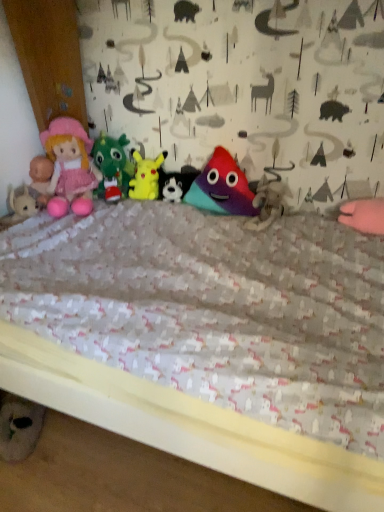
Question: Is matte plastic pyramid at center, arranged as the 3th toy when viewed from the right, positioned behind multicolored fabric triangle at center, which is counted as the fifth toy, starting from the left?

Choices:
 (A) yes
 (B) no

Answer: (A)

Question: From a real-world perspective, is matte plastic pyramid at center, marked as the 3th toy in a left-to-right arrangement, over multicolored fabric triangle at center, acting as the 1th toy starting from the right?

Choices:
 (A) no
 (B) yes

Answer: (B)

Question: From the image's perspective, would you say matte plastic pyramid at center, arranged as the 3th toy when viewed from the right, is shown under multicolored fabric triangle at center, acting as the 1th toy starting from the right?

Choices:
 (A) yes
 (B) no

Answer: (B)

Question: Is matte plastic pyramid at center, marked as the 3th toy in a left-to-right arrangement, positioned far away from multicolored fabric triangle at center, acting as the 1th toy starting from the right?

Choices:
 (A) yes
 (B) no

Answer: (B)

Question: Does matte plastic pyramid at center, arranged as the 3th toy when viewed from the right, appear on the left side of multicolored fabric triangle at center, acting as the 1th toy starting from the right?

Choices:
 (A) yes
 (B) no

Answer: (A)

Question: Is matte plastic pyramid at center, arranged as the 3th toy when viewed from the right, not inside multicolored fabric triangle at center, which is counted as the fifth toy, starting from the left?

Choices:
 (A) no
 (B) yes

Answer: (B)

Question: From a real-world perspective, does yellow plush at center, which is the second toy in left-to-right order, stand above velvety green dragon at center, the 1th toy in the left-to-right sequence?

Choices:
 (A) no
 (B) yes

Answer: (A)

Question: From the image's perspective, would you say yellow plush at center, which is the second toy in left-to-right order, is shown under velvety green dragon at center, the 1th toy in the left-to-right sequence?

Choices:
 (A) yes
 (B) no

Answer: (A)

Question: Is yellow plush at center, which is the second toy in left-to-right order, completely or partially outside of velvety green dragon at center, the 1th toy in the left-to-right sequence?

Choices:
 (A) yes
 (B) no

Answer: (A)

Question: From the image's perspective, is yellow plush at center, which is the second toy in left-to-right order, above velvety green dragon at center, the 1th toy in the left-to-right sequence?

Choices:
 (A) no
 (B) yes

Answer: (A)

Question: Is yellow plush at center, marked as the 4th toy in a right-to-left arrangement, facing towards velvety green dragon at center, which is counted as the 5th toy, starting from the right?

Choices:
 (A) no
 (B) yes

Answer: (A)

Question: Does yellow plush at center, which is the second toy in left-to-right order, come in front of velvety green dragon at center, which is counted as the 5th toy, starting from the right?

Choices:
 (A) no
 (B) yes

Answer: (A)

Question: Does pink plush doll at left have a larger size compared to multicolored fabric triangle at center, acting as the 1th toy starting from the right?

Choices:
 (A) no
 (B) yes

Answer: (B)